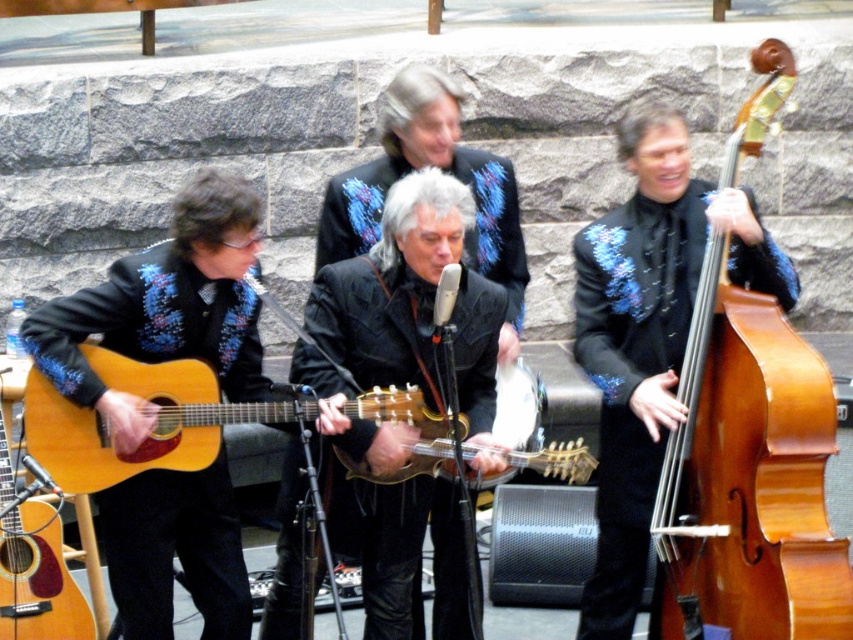
Question: Considering the relative positions of brown wooden cello at right and light brown wood guitar at center in the image provided, where is brown wooden cello at right located with respect to light brown wood guitar at center?

Choices:
 (A) above
 (B) below

Answer: (A)

Question: Considering the real-world distances, which object is farthest from the light brown wood guitar at center?

Choices:
 (A) matte wood guitar at left
 (B) brown wooden cello at right
 (C) shiny gold guitar at center
 (D) shiny black guitar at center

Answer: (B)

Question: Does brown wooden cello at right have a smaller size compared to shiny black guitar at center?

Choices:
 (A) no
 (B) yes

Answer: (A)

Question: Does brown wooden cello at right have a larger size compared to shiny gold guitar at center?

Choices:
 (A) yes
 (B) no

Answer: (A)

Question: Which point appears farthest from the camera in this image?

Choices:
 (A) (4, 570)
 (B) (392, 413)

Answer: (A)

Question: Which point appears farthest from the camera in this image?

Choices:
 (A) (426, 461)
 (B) (10, 548)
 (C) (425, 433)
 (D) (711, 371)

Answer: (B)